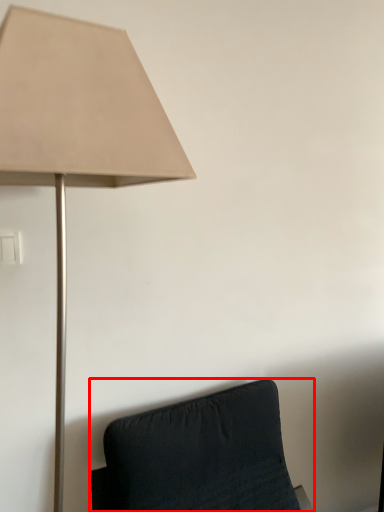
Question: From the image's perspective, considering the relative positions of furniture (annotated by the red box) and lamp in the image provided, where is furniture (annotated by the red box) located with respect to the staircase?

Choices:
 (A) above
 (B) below

Answer: (B)